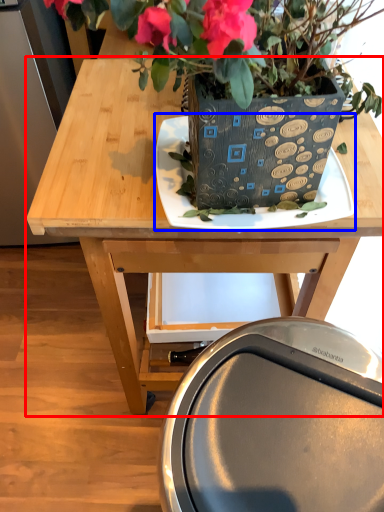
Question: Among these objects, which one is farthest to the camera, table (highlighted by a red box) or plate (highlighted by a blue box)?

Choices:
 (A) table
 (B) plate

Answer: (A)